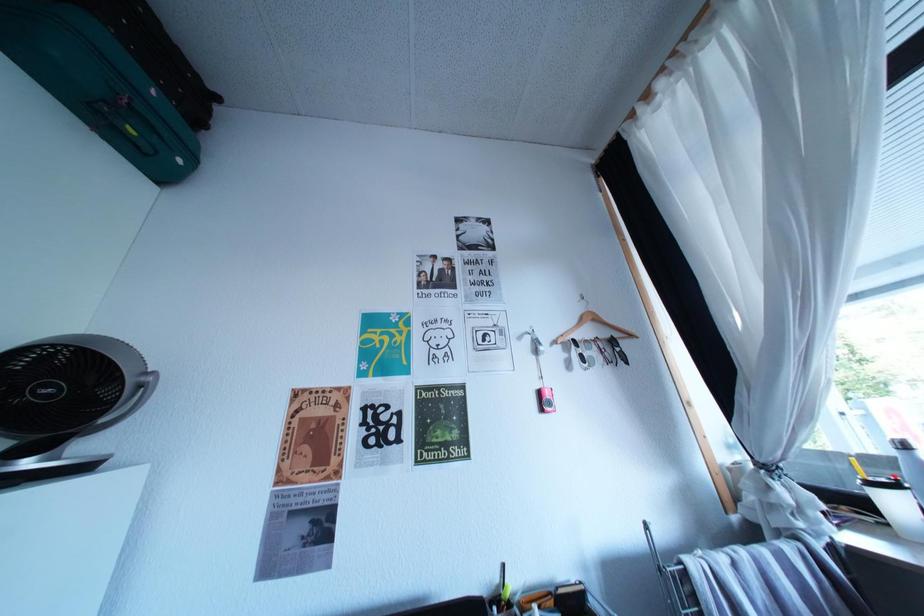
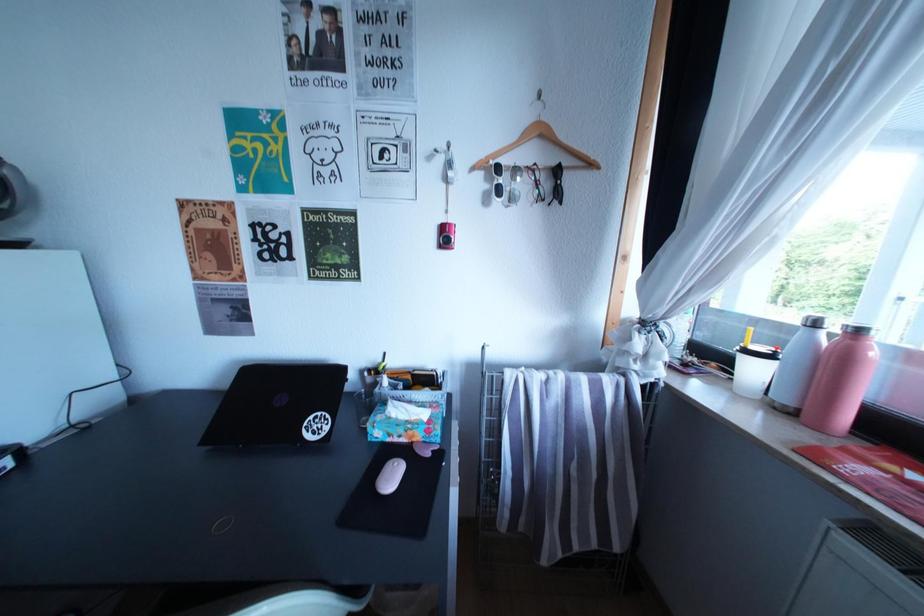
Question: How did the camera likely rotate?

Choices:
 (A) Left
 (B) Right
 (C) Up
 (D) Down

Answer: (D)